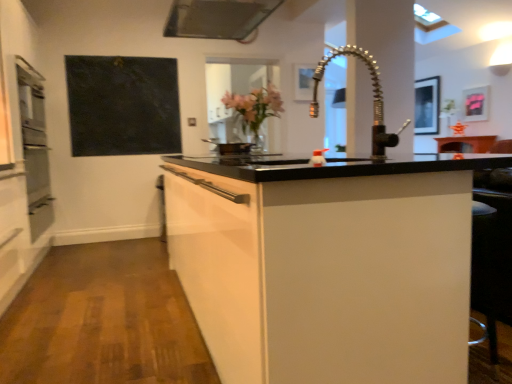
At what (x,y) coordinates should I click in order to perform the action: click on free point above black matte board at upper left (from a real-world perspective). Please return your answer as a coordinate pair (x, y). The image size is (512, 384). Looking at the image, I should click on (121, 60).